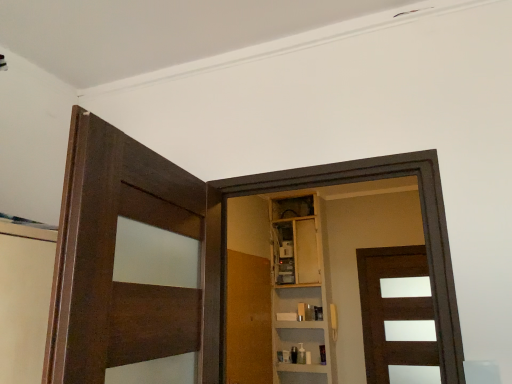
Question: Considering the positions of brown matte door at center, acting as the third door starting from the front, and dark wood door at left, arranged as the first door when viewed from the front, in the image, is brown matte door at center, acting as the third door starting from the front, wider or thinner than dark wood door at left, arranged as the first door when viewed from the front,?

Choices:
 (A) wide
 (B) thin

Answer: (B)

Question: Is point (411, 345) closer or farther from the camera than point (130, 157)?

Choices:
 (A) closer
 (B) farther

Answer: (B)

Question: Estimate the real-world distances between objects in this image. Which object is farther from the dark wood door at left, the first door viewed from the left?

Choices:
 (A) brown matte door at center, the 1th door positioned from the right
 (B) wooden cabinet at center
 (C) wooden door at center, which ranks as the 2th door in right-to-left order

Answer: (A)

Question: Considering the real-world distances, which object is farthest from the wooden door at center, the 2th door when ordered from front to back?

Choices:
 (A) dark wood door at left, arranged as the first door when viewed from the front
 (B) wooden cabinet at center
 (C) brown matte door at center, which appears as the 1th door when viewed from the back

Answer: (A)